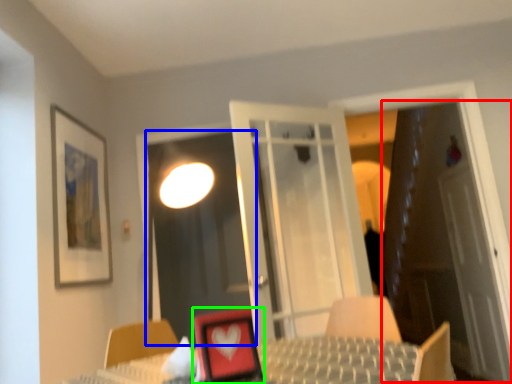
Question: Which is farther away from door (highlighted by a red box)? screen door (highlighted by a blue box) or picture frame (highlighted by a green box)?

Choices:
 (A) screen door
 (B) picture frame

Answer: (B)